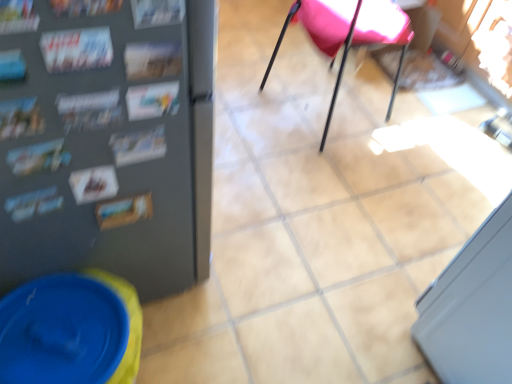
Question: From a real-world perspective, is matte paper magazine at upper left, the 1th magazine viewed from the right, physically above pink fabric chair at center?

Choices:
 (A) yes
 (B) no

Answer: (A)

Question: Is matte paper magazine at upper left, the 1th magazine viewed from the right, next to pink fabric chair at center?

Choices:
 (A) yes
 (B) no

Answer: (B)

Question: From the image's perspective, would you say matte paper magazine at upper left, which is counted as the 3th magazine, starting from the left, is positioned over pink fabric chair at center?

Choices:
 (A) yes
 (B) no

Answer: (B)

Question: Is matte paper magazine at upper left, which is counted as the 3th magazine, starting from the left, far away from pink fabric chair at center?

Choices:
 (A) no
 (B) yes

Answer: (B)

Question: Does matte paper magazine at upper left, the 1th magazine viewed from the right, have a larger size compared to pink fabric chair at center?

Choices:
 (A) yes
 (B) no

Answer: (B)

Question: Considering the positions of printed paper magazine at upper left, arranged as the second magazine when viewed from the left, and pink fabric chair at center in the image, is printed paper magazine at upper left, arranged as the second magazine when viewed from the left, taller or shorter than pink fabric chair at center?

Choices:
 (A) short
 (B) tall

Answer: (A)

Question: Is printed paper magazine at upper left, which ranks as the second magazine in right-to-left order, in front of or behind pink fabric chair at center in the image?

Choices:
 (A) front
 (B) behind

Answer: (A)

Question: Looking at their shapes, would you say printed paper magazine at upper left, arranged as the second magazine when viewed from the left, is wider or thinner than pink fabric chair at center?

Choices:
 (A) wide
 (B) thin

Answer: (B)

Question: From a real-world perspective, is printed paper magazine at upper left, arranged as the second magazine when viewed from the left, above or below pink fabric chair at center?

Choices:
 (A) above
 (B) below

Answer: (A)

Question: Is pink fabric chair at center bigger or smaller than printed paper magazine at upper left, arranged as the second magazine when viewed from the left?

Choices:
 (A) small
 (B) big

Answer: (B)

Question: Is pink fabric chair at center wider or thinner than printed paper magazine at upper left, arranged as the second magazine when viewed from the left?

Choices:
 (A) thin
 (B) wide

Answer: (B)

Question: Relative to printed paper magazine at upper left, arranged as the second magazine when viewed from the left, is pink fabric chair at center in front or behind?

Choices:
 (A) front
 (B) behind

Answer: (B)

Question: From the image's perspective, is pink fabric chair at center located above or below printed paper magazine at upper left, arranged as the second magazine when viewed from the left?

Choices:
 (A) below
 (B) above

Answer: (B)

Question: Is point (82, 41) closer or farther from the camera than point (134, 76)?

Choices:
 (A) farther
 (B) closer

Answer: (B)

Question: Considering the positions of printed paper magazine at left, placed as the first magazine when sorted from left to right, and printed paper magazine at upper left, which ranks as the second magazine in right-to-left order, in the image, is printed paper magazine at left, placed as the first magazine when sorted from left to right, taller or shorter than printed paper magazine at upper left, which ranks as the second magazine in right-to-left order,?

Choices:
 (A) tall
 (B) short

Answer: (A)